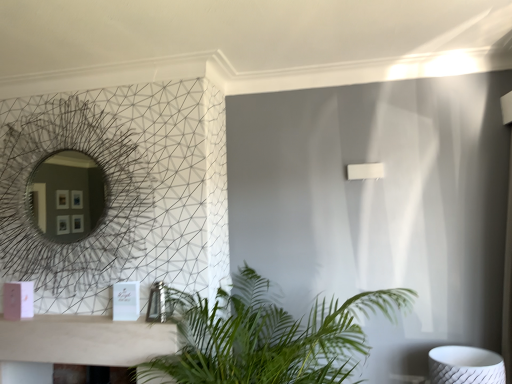
Question: In the image, is green leafy plant at lower center on the left side or the right side of metallic wire mesh mirror at upper left?

Choices:
 (A) left
 (B) right

Answer: (B)

Question: In terms of height, does green leafy plant at lower center look taller or shorter compared to metallic wire mesh mirror at upper left?

Choices:
 (A) short
 (B) tall

Answer: (A)

Question: In terms of width, does green leafy plant at lower center look wider or thinner when compared to metallic wire mesh mirror at upper left?

Choices:
 (A) thin
 (B) wide

Answer: (B)

Question: Is metallic wire mesh mirror at upper left bigger or smaller than green leafy plant at lower center?

Choices:
 (A) big
 (B) small

Answer: (B)

Question: From the image's perspective, is metallic wire mesh mirror at upper left located above or below green leafy plant at lower center?

Choices:
 (A) below
 (B) above

Answer: (B)

Question: In terms of width, does metallic wire mesh mirror at upper left look wider or thinner when compared to green leafy plant at lower center?

Choices:
 (A) wide
 (B) thin

Answer: (B)

Question: Is metallic wire mesh mirror at upper left inside or outside of green leafy plant at lower center?

Choices:
 (A) outside
 (B) inside

Answer: (A)